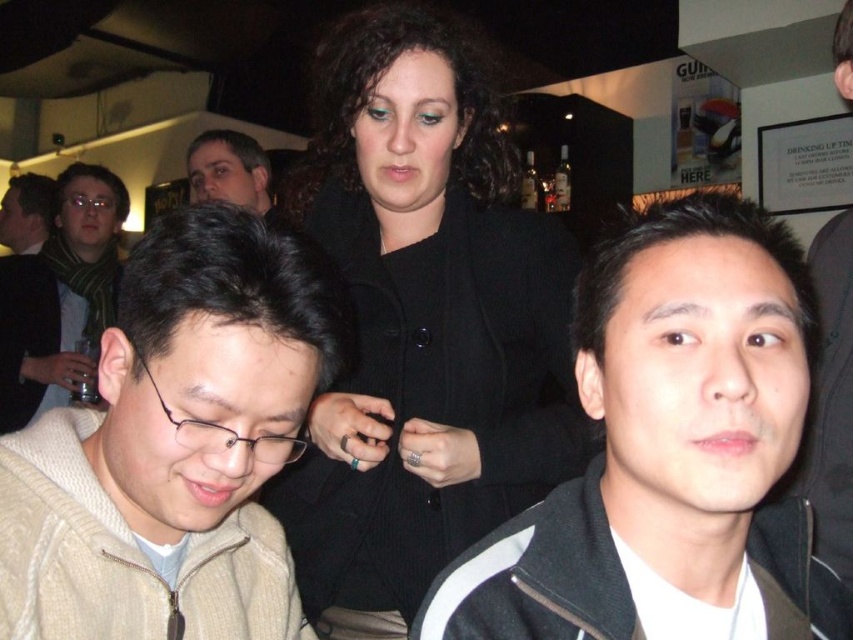
Is point (9, 353) farther from viewer compared to point (236, 147)?

No, (9, 353) is in front of (236, 147).

Between matte black glasses at left and matte black jacket at upper center, which one is positioned lower?

matte black glasses at left is below.

Where is `matte black glasses at left`? matte black glasses at left is located at coordinates point(61,296).

Is black matte jacket at center closer to camera compared to matte black glasses at left?

Yes, black matte jacket at center is closer to the viewer.

Does black matte jacket at center have a lesser height compared to matte black glasses at left?

Indeed, black matte jacket at center has a lesser height compared to matte black glasses at left.

The image size is (853, 640). What do you see at coordinates (669, 454) in the screenshot?
I see `black matte jacket at center` at bounding box center [669, 454].

This screenshot has height=640, width=853. I want to click on black matte jacket at center, so click(x=669, y=454).

Is black woolen coat at center bigger than matte black jacket at left?

Incorrect, black woolen coat at center is not larger than matte black jacket at left.

Which is more to the right, black woolen coat at center or matte black jacket at left?

black woolen coat at center is more to the right.

Between point (524, 282) and point (4, 237), which one is positioned behind?

Point (4, 237)

What are the coordinates of `black woolen coat at center` in the screenshot? It's located at (424, 330).